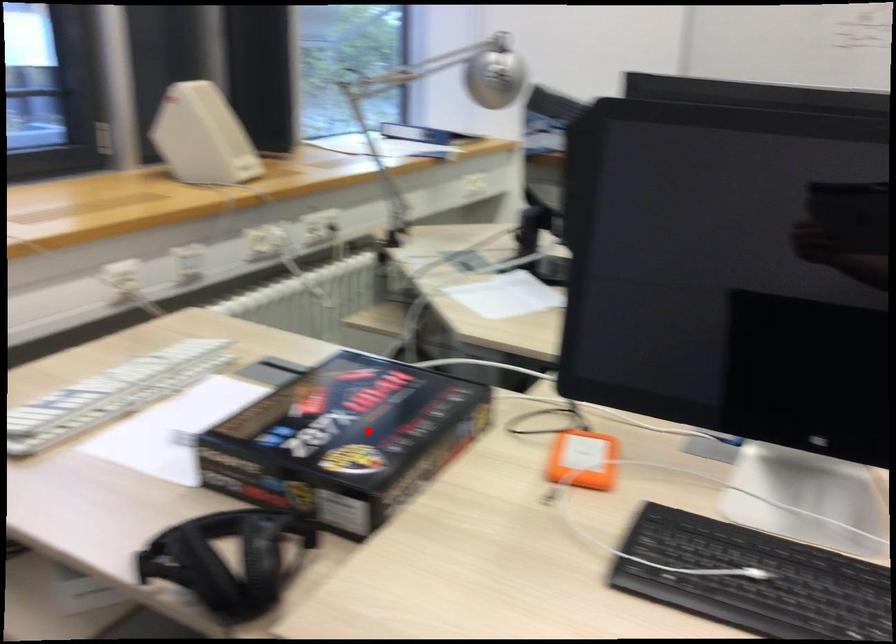
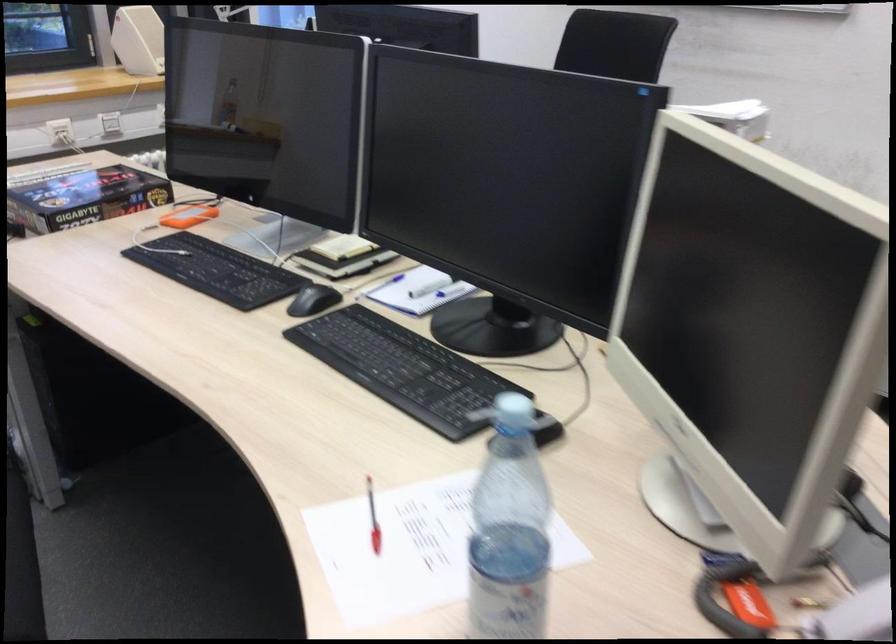
Question: A red point is marked in image1. In image2, is the corresponding 3D point closer to the camera or farther? Reply with the corresponding letter.

Choices:
 (A) The corresponding 3D point is closer.
 (B) The corresponding 3D point is farther.

Answer: (B)